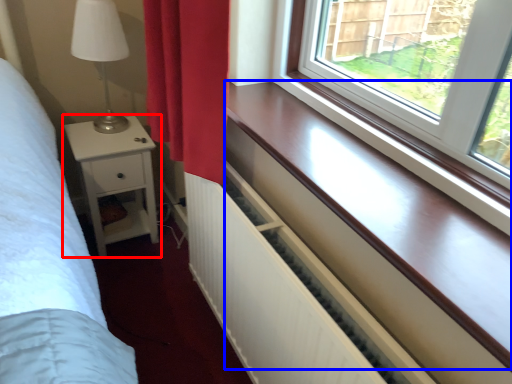
Question: Among these objects, which one is farthest to the camera, nightstand (highlighted by a red box) or window sill (highlighted by a blue box)?

Choices:
 (A) nightstand
 (B) window sill

Answer: (A)